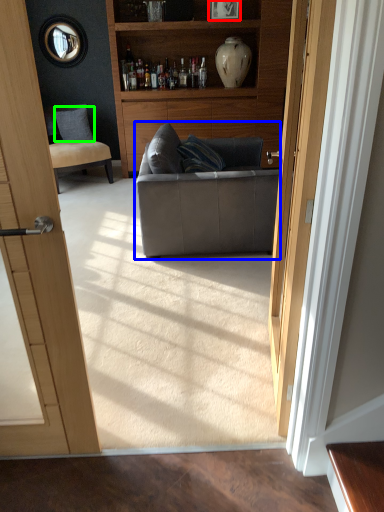
Question: Which object is the closest to the picture frame (highlighted by a red box)? Choose among these: studio couch (highlighted by a blue box) or pillow (highlighted by a green box).

Choices:
 (A) studio couch
 (B) pillow

Answer: (B)